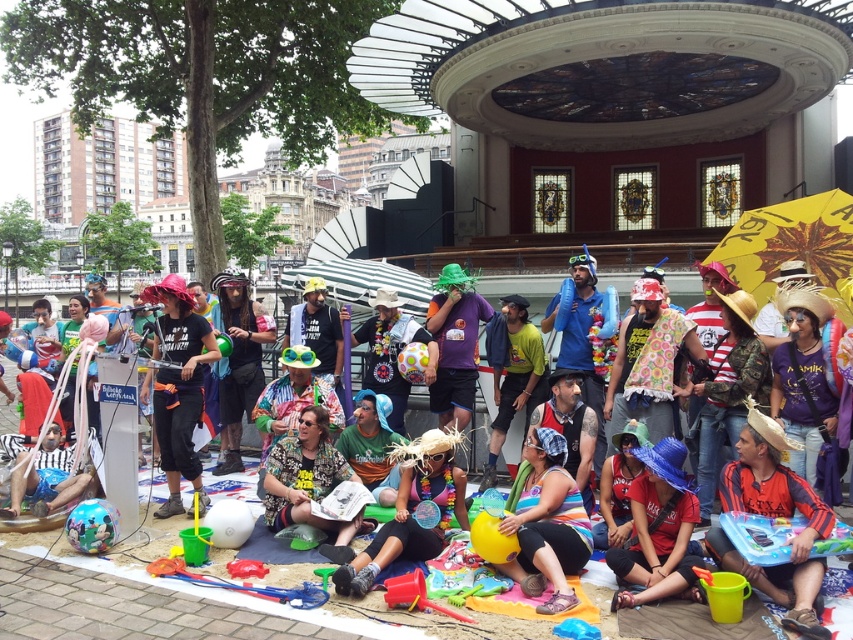
You are organizing a space for an upcoming event and need to arrange items. You have the rainbow fabric dress at center and the red plastic shovel at lower center. Which item takes up more physical space?

The red plastic shovel at lower center occupies more physical space than the rainbow fabric dress at center, according to the description.